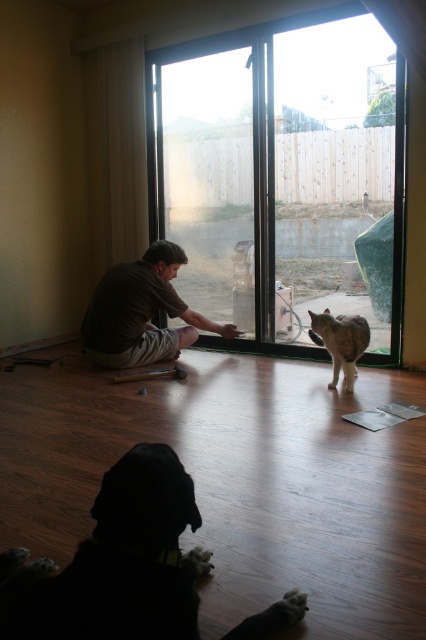
You are a delivery robot with a height of 1.5 meters. You need to deliver a package to the point marked as point [178,476]. The robot has a height of 1.5 meters. Can you reach the point without bending down?

The distance of point [178,476] from camera is 1.08 meters. Since the robot is 1.5 meters tall, it can reach the point without bending down as the vertical clearance is sufficient.